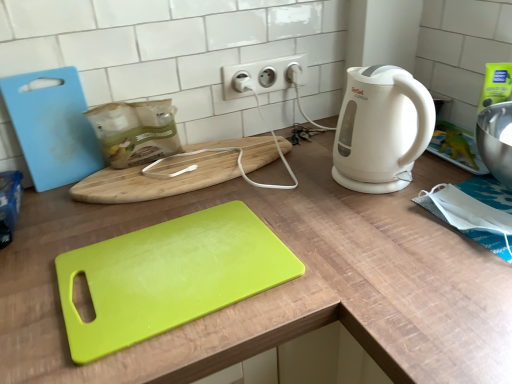
This screenshot has height=384, width=512. Describe the element at coordinates (157, 179) in the screenshot. I see `wooden cutting board at center, marked as the first cutting board in a back-to-front arrangement` at that location.

Image resolution: width=512 pixels, height=384 pixels. What are the coordinates of `light blue plastic cutting board at left, marked as the second cutting board in a back-to-front arrangement` in the screenshot? It's located at (52, 127).

The width and height of the screenshot is (512, 384). I want to click on lime green plastic cutting board at center, so click(x=281, y=285).

Identify the location of wooden cutting board at center, marked as the first cutting board in a back-to-front arrangement. (157, 179).

Does wooden cutting board at center, marked as the first cutting board in a back-to-front arrangement, turn towards lime green plastic cutting board at center?

Yes.

How different are the orientations of wooden cutting board at center, marked as the 3th cutting board in a front-to-back arrangement, and lime green plastic cutting board at center in degrees?

0.000565 degrees.

From a real-world perspective, which object stands above the other?

wooden cutting board at center, marked as the first cutting board in a back-to-front arrangement.

Measure the distance from wooden cutting board at center, marked as the 3th cutting board in a front-to-back arrangement, to lime green plastic cutting board at center.

A distance of 8.08 inches exists between wooden cutting board at center, marked as the 3th cutting board in a front-to-back arrangement, and lime green plastic cutting board at center.

From a real-world perspective, who is located lower, lime green plastic cutting board at center or white matte electric kettle at right?

From a 3D spatial view, lime green plastic cutting board at center is below.

Would you consider lime green plastic cutting board at center to be distant from white matte electric kettle at right?

That's not correct — lime green plastic cutting board at center is a little close to white matte electric kettle at right.

Can white matte electric kettle at right be found inside lime green plastic cutting board at center?

No.

Based on the photo, can you confirm if lime green plastic cutting board at center is wider than white matte electric kettle at right?

Yes.

Is light blue plastic cutting board at left, marked as the second cutting board in a back-to-front arrangement, wider or thinner than white plastic electric outlet at upper center?

Considering their sizes, light blue plastic cutting board at left, marked as the second cutting board in a back-to-front arrangement, looks broader than white plastic electric outlet at upper center.

Is light blue plastic cutting board at left, marked as the second cutting board in a back-to-front arrangement, positioned before white plastic electric outlet at upper center?

Yes, the depth of light blue plastic cutting board at left, marked as the second cutting board in a back-to-front arrangement, is less than that of white plastic electric outlet at upper center.

Consider the image. What's the angular difference between light blue plastic cutting board at left, marked as the second cutting board in a back-to-front arrangement, and white plastic electric outlet at upper center's facing directions?

They differ by 0.00286 degrees in their facing directions.

Looking at this image, from the image's perspective, is light blue plastic cutting board at left, the 2th cutting board viewed from the front, above white plastic electric outlet at upper center?

Actually, light blue plastic cutting board at left, the 2th cutting board viewed from the front, appears below white plastic electric outlet at upper center in the image.

Is lime green plastic cutting board at center inside the boundaries of wooden cutting board at center, marked as the first cutting board in a back-to-front arrangement, or outside?

lime green plastic cutting board at center exists outside the volume of wooden cutting board at center, marked as the first cutting board in a back-to-front arrangement.

In the scene shown: Does lime green plastic cutting board at center have a lesser width compared to wooden cutting board at center, marked as the 3th cutting board in a front-to-back arrangement?

Incorrect, the width of lime green plastic cutting board at center is not less than that of wooden cutting board at center, marked as the 3th cutting board in a front-to-back arrangement.

Between lime green plastic cutting board at center and wooden cutting board at center, marked as the first cutting board in a back-to-front arrangement, which one appears on the left side from the viewer's perspective?

lime green plastic cutting board at center is more to the left.

Considering the points (451, 338) and (113, 190), which point is in front, point (451, 338) or point (113, 190)?

The point (451, 338) is closer to the camera.

Does lime green plastic cutting board at center, the third cutting board from the back, appear on the left side of lime green plastic cutting board at center?

Incorrect, lime green plastic cutting board at center, the third cutting board from the back, is not on the left side of lime green plastic cutting board at center.

Looking at the image, does lime green plastic cutting board at center, which appears as the first cutting board when viewed from the front, seem bigger or smaller compared to lime green plastic cutting board at center?

Considering their sizes, lime green plastic cutting board at center, which appears as the first cutting board when viewed from the front, takes up less space than lime green plastic cutting board at center.

Is lime green plastic cutting board at center, the third cutting board from the back, behind lime green plastic cutting board at center?

Yes, it is behind lime green plastic cutting board at center.

Is lime green plastic cutting board at center, the third cutting board from the back, positioned with its back to lime green plastic cutting board at center?

Correct, lime green plastic cutting board at center, the third cutting board from the back, is looking away from lime green plastic cutting board at center.

Which object is positioned more to the right, white matte electric kettle at right or white plastic electric outlet at upper center?

Positioned to the right is white matte electric kettle at right.

Does white matte electric kettle at right have a smaller size compared to white plastic electric outlet at upper center?

Actually, white matte electric kettle at right might be larger than white plastic electric outlet at upper center.

What's the angular difference between white matte electric kettle at right and white plastic electric outlet at upper center's facing directions?

white matte electric kettle at right and white plastic electric outlet at upper center are facing 90 degrees away from each other.

Between white matte electric kettle at right and white plastic electric outlet at upper center, which one is positioned in front?

Positioned in front is white matte electric kettle at right.

From the image's perspective, count 2nd cutting boards downward from the white plastic electric outlet at upper center and point to it. Please provide its 2D coordinates.

[(157, 179)]

In the scene shown: Is white plastic electric outlet at upper center far away from wooden cutting board at center, marked as the 3th cutting board in a front-to-back arrangement?

They are positioned close to each other.

Which of these two, white plastic electric outlet at upper center or wooden cutting board at center, marked as the first cutting board in a back-to-front arrangement, is wider?

wooden cutting board at center, marked as the first cutting board in a back-to-front arrangement.

From the image's perspective, is white plastic electric outlet at upper center on wooden cutting board at center, marked as the 3th cutting board in a front-to-back arrangement?

Correct, white plastic electric outlet at upper center appears higher than wooden cutting board at center, marked as the 3th cutting board in a front-to-back arrangement, in the image.

Image resolution: width=512 pixels, height=384 pixels. I want to click on counter below the wooden cutting board at center, marked as the 3th cutting board in a front-to-back arrangement (from a real-world perspective), so click(281, 285).

Find the location of a particular element. counter in front of the white matte electric kettle at right is located at coordinates (281, 285).

From the picture: Considering their positions, is lime green plastic cutting board at center, the third cutting board from the back, positioned further to lime green plastic cutting board at center than white plastic electric outlet at upper center?

white plastic electric outlet at upper center is positioned further to the anchor lime green plastic cutting board at center.

Based on their spatial positions, is lime green plastic cutting board at center or lime green plastic cutting board at center, which appears as the first cutting board when viewed from the front, closer to white matte electric kettle at right?

lime green plastic cutting board at center.

When comparing their distances from white matte electric kettle at right, does wooden cutting board at center, marked as the first cutting board in a back-to-front arrangement, or lime green plastic cutting board at center seem closer?

Among the two, lime green plastic cutting board at center is located nearer to white matte electric kettle at right.

From the image, which object appears to be nearer to light blue plastic cutting board at left, marked as the second cutting board in a back-to-front arrangement, lime green plastic cutting board at center or wooden cutting board at center, marked as the first cutting board in a back-to-front arrangement?

wooden cutting board at center, marked as the first cutting board in a back-to-front arrangement, is positioned closer to the anchor light blue plastic cutting board at left, marked as the second cutting board in a back-to-front arrangement.

Considering their positions, is lime green plastic cutting board at center positioned closer to wooden cutting board at center, marked as the first cutting board in a back-to-front arrangement, than white matte electric kettle at right?

lime green plastic cutting board at center is positioned closer to the anchor wooden cutting board at center, marked as the first cutting board in a back-to-front arrangement.

When comparing their distances from white plastic electric outlet at upper center, does white matte electric kettle at right or lime green plastic cutting board at center seem further?

Among the two, lime green plastic cutting board at center is located further to white plastic electric outlet at upper center.

Estimate the real-world distances between objects in this image. Which object is further from white matte electric kettle at right, white plastic electric outlet at upper center or light blue plastic cutting board at left, the 2th cutting board viewed from the front?

Based on the image, light blue plastic cutting board at left, the 2th cutting board viewed from the front, appears to be further to white matte electric kettle at right.

Looking at the image, which one is located further to lime green plastic cutting board at center, light blue plastic cutting board at left, the 2th cutting board viewed from the front, or white matte electric kettle at right?

Based on the image, light blue plastic cutting board at left, the 2th cutting board viewed from the front, appears to be further to lime green plastic cutting board at center.

I want to click on home appliance between lime green plastic cutting board at center, the third cutting board from the back, and white plastic electric outlet at upper center from front to back, so click(x=381, y=129).

At what (x,y) coordinates should I click in order to perform the action: click on electric outlet between light blue plastic cutting board at left, marked as the second cutting board in a back-to-front arrangement, and white matte electric kettle at right, in the horizontal direction. Please return your answer as a coordinate pair (x, y). The height and width of the screenshot is (384, 512). Looking at the image, I should click on (264, 76).

Image resolution: width=512 pixels, height=384 pixels. In order to click on counter between light blue plastic cutting board at left, the 2th cutting board viewed from the front, and white matte electric kettle at right from left to right in this screenshot , I will do `click(281, 285)`.

Where is `cutting board between wooden cutting board at center, marked as the 3th cutting board in a front-to-back arrangement, and white matte electric kettle at right`? cutting board between wooden cutting board at center, marked as the 3th cutting board in a front-to-back arrangement, and white matte electric kettle at right is located at coordinates [169, 276].